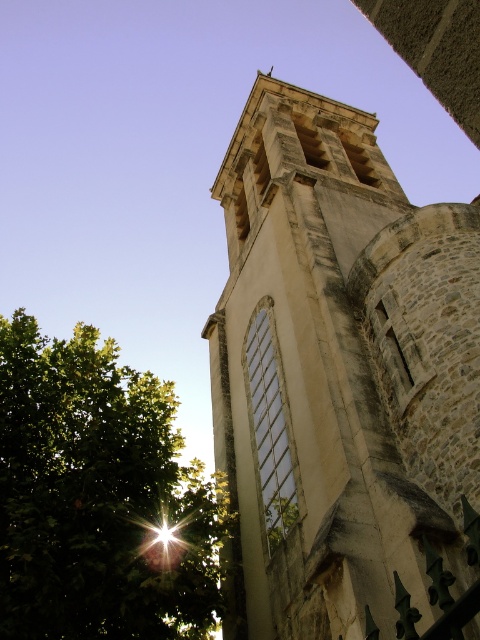
Question: Among these objects, which one is farthest from the camera?

Choices:
 (A) green leafy tree at lower left
 (B) stone tower at center

Answer: (A)

Question: In this image, where is stone tower at center located relative to green leafy tree at lower left?

Choices:
 (A) above
 (B) below

Answer: (A)

Question: Which point is closer to the camera?

Choices:
 (A) stone tower at center
 (B) green leafy tree at lower left

Answer: (A)

Question: Is stone tower at center above green leafy tree at lower left?

Choices:
 (A) yes
 (B) no

Answer: (A)

Question: Can you confirm if stone tower at center is smaller than green leafy tree at lower left?

Choices:
 (A) no
 (B) yes

Answer: (A)